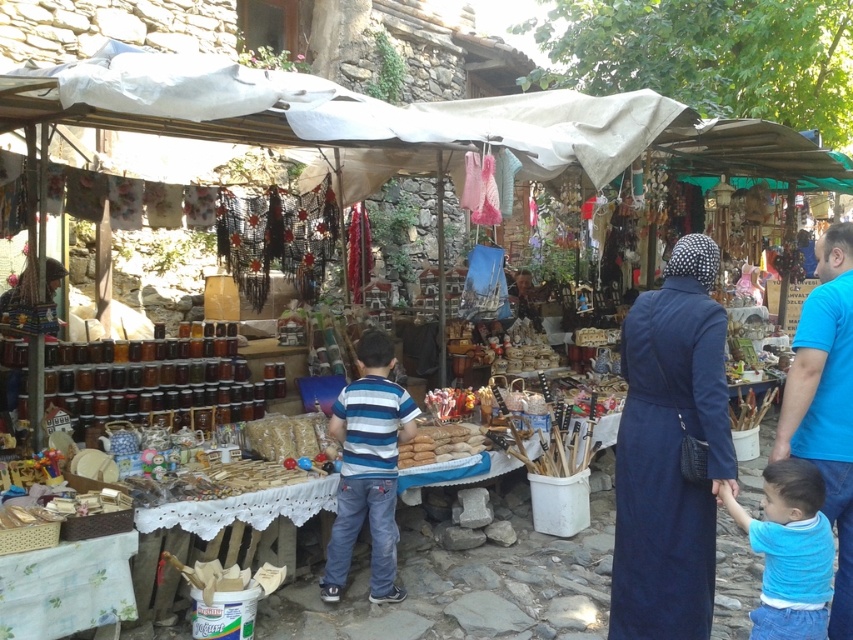
You are standing at the market and want to take a photo of both the point at coordinates point (848, 346) and point (788, 516). Which point should you focus on first to ensure both are in focus?

You should focus on point (848, 346) first because it is closer to the camera than point (788, 516). This ensures that both points will be within the depth of field.

You are a customer at the market and want to pick up the brown matte bread at center. However, the striped cotton shirt at center is blocking your view. Can you reach the bread without moving the shirt?

The striped cotton shirt at center is positioned under the brown matte bread at center, so you can reach the bread without moving the shirt since it is above it.